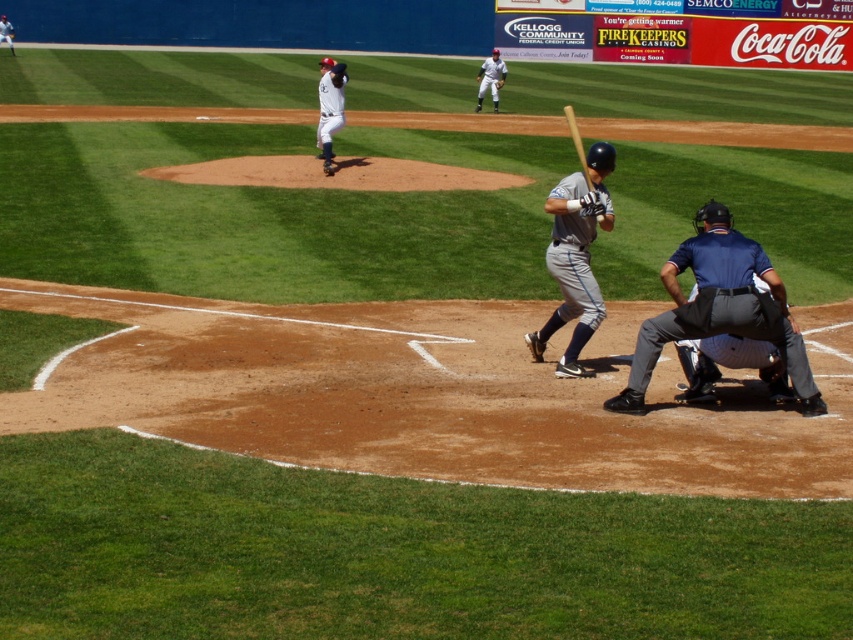
Based on the scene description, where is the white uniform at upper center located in the image?

The white uniform at upper center is located at point (490, 80) in the image.